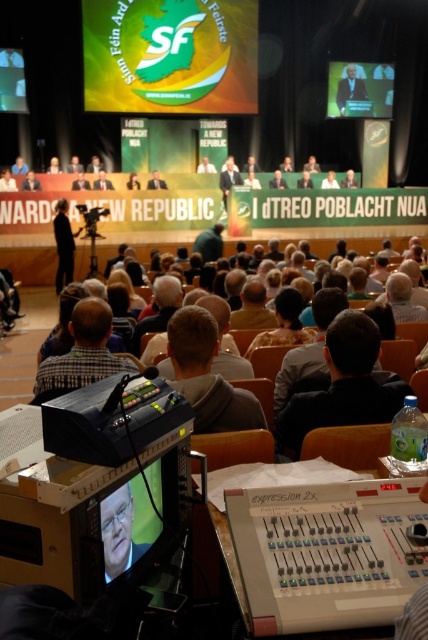
Question: Does dark gray suit at center have a smaller size compared to matte black screen at upper right?

Choices:
 (A) no
 (B) yes

Answer: (B)

Question: Which object is farther from the camera taking this photo?

Choices:
 (A) dark gray suit at center
 (B) blonde hair at center
 (C) plaid fabric shirt at center

Answer: (C)

Question: Which of the following is the closest to the observer?

Choices:
 (A) light brown suit at upper center
 (B) dark brown suit at center

Answer: (B)

Question: Can you confirm if blonde hair at center is positioned above dark brown suit at center?

Choices:
 (A) no
 (B) yes

Answer: (A)

Question: Which point appears closest to the camera in this image?

Choices:
 (A) click(341, 93)
 (B) click(228, 163)

Answer: (B)

Question: Does green matte logo at upper center have a lesser width compared to light brown suit at upper center?

Choices:
 (A) no
 (B) yes

Answer: (A)